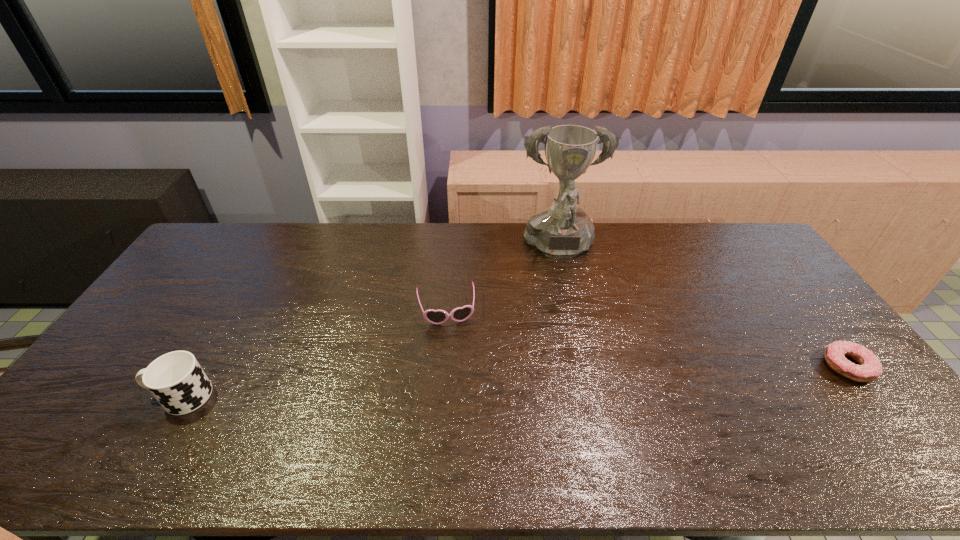
The height and width of the screenshot is (540, 960). I want to click on the second tallest object, so click(176, 380).

The width and height of the screenshot is (960, 540). In order to click on cup in this screenshot , I will do `click(176, 380)`.

What are the coordinates of `the rightmost object` in the screenshot? It's located at (869, 369).

Find the location of a particular element. The width and height of the screenshot is (960, 540). doughnut is located at coordinates 869,369.

The height and width of the screenshot is (540, 960). Identify the location of the third tallest object. (460, 314).

The width and height of the screenshot is (960, 540). In order to click on the second object from left to right in this screenshot , I will do `click(460, 314)`.

What are the coordinates of `the tallest object` in the screenshot? It's located at (562, 231).

Identify the location of award. (x=562, y=231).

Identify the location of vacant point located 0.070m on the side of the cup with the handle. This screenshot has height=540, width=960. (125, 396).

The width and height of the screenshot is (960, 540). I want to click on vacant space positioned on the side of the cup with the handle, so click(106, 396).